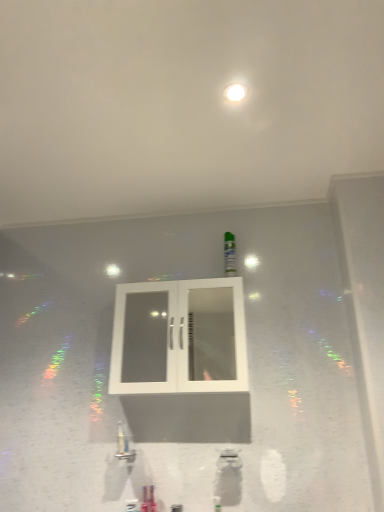
Question: Do you think green matte bottle at center is within white glass cabinet at center, or outside of it?

Choices:
 (A) inside
 (B) outside

Answer: (B)

Question: Considering the positions of green matte bottle at center and white glass cabinet at center in the image, is green matte bottle at center bigger or smaller than white glass cabinet at center?

Choices:
 (A) small
 (B) big

Answer: (A)

Question: Based on their relative distances, which object is nearer to the green matte bottle at center?

Choices:
 (A) white glass cabinet at center
 (B) white matte ceiling at upper center

Answer: (A)

Question: Which object is positioned closest to the green matte bottle at center?

Choices:
 (A) white matte ceiling at upper center
 (B) white glass cabinet at center

Answer: (B)